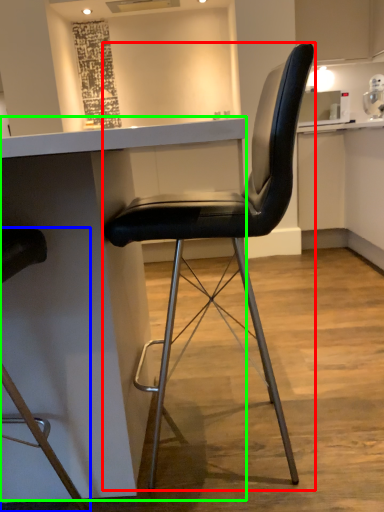
Question: Which is nearer to the chair (highlighted by a red box)? chair (highlighted by a blue box) or table (highlighted by a green box).

Choices:
 (A) chair
 (B) table

Answer: (B)